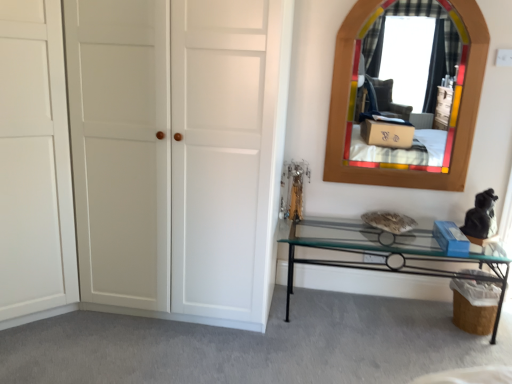
Question: Is wooden stained mirror at upper right outside of white matte door at left, the second door viewed from the right?

Choices:
 (A) yes
 (B) no

Answer: (A)

Question: Is wooden stained mirror at upper right behind white matte door at left, the second door viewed from the right?

Choices:
 (A) yes
 (B) no

Answer: (A)

Question: Can you confirm if wooden stained mirror at upper right is smaller than white matte door at left, which is the 1th door in left-to-right order?

Choices:
 (A) no
 (B) yes

Answer: (B)

Question: Is white matte door at left, the second door viewed from the right, at the back of wooden stained mirror at upper right?

Choices:
 (A) yes
 (B) no

Answer: (B)

Question: Can you confirm if wooden stained mirror at upper right is wider than white matte door at left, which is the 1th door in left-to-right order?

Choices:
 (A) no
 (B) yes

Answer: (A)

Question: Is white matte door at left, the second door viewed from the right, bigger or smaller than clear glass table at lower right?

Choices:
 (A) small
 (B) big

Answer: (B)

Question: Is white matte door at left, the second door viewed from the right, inside or outside of clear glass table at lower right?

Choices:
 (A) outside
 (B) inside

Answer: (A)

Question: From a real-world perspective, relative to clear glass table at lower right, is white matte door at left, which is the 1th door in left-to-right order, vertically above or below?

Choices:
 (A) below
 (B) above

Answer: (B)

Question: Considering the positions of white matte door at left, the second door viewed from the right, and clear glass table at lower right in the image, is white matte door at left, the second door viewed from the right, taller or shorter than clear glass table at lower right?

Choices:
 (A) short
 (B) tall

Answer: (B)

Question: Considering the positions of point (368, 29) and point (121, 122), is point (368, 29) closer or farther from the camera than point (121, 122)?

Choices:
 (A) farther
 (B) closer

Answer: (A)

Question: From a real-world perspective, is wooden stained mirror at upper right physically located above or below white matte door at left, the first door viewed from the right?

Choices:
 (A) above
 (B) below

Answer: (A)

Question: Considering the positions of wooden stained mirror at upper right and white matte door at left, which is counted as the 2th door, starting from the left, in the image, is wooden stained mirror at upper right taller or shorter than white matte door at left, which is counted as the 2th door, starting from the left,?

Choices:
 (A) short
 (B) tall

Answer: (A)

Question: From the image's perspective, is wooden stained mirror at upper right positioned above or below white matte door at left, the first door viewed from the right?

Choices:
 (A) above
 (B) below

Answer: (A)

Question: From a real-world perspective, relative to white matte door at left, the first door viewed from the right, is clear glass table at lower right vertically above or below?

Choices:
 (A) above
 (B) below

Answer: (B)

Question: Would you say clear glass table at lower right is inside or outside white matte door at left, the first door viewed from the right?

Choices:
 (A) inside
 (B) outside

Answer: (B)